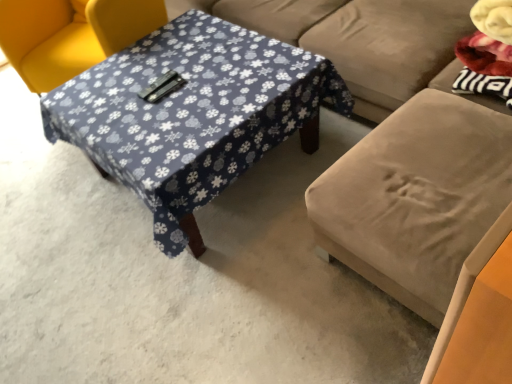
Question: Is yellow fabric chair at upper left taller or shorter than blue fabric-covered table at center?

Choices:
 (A) short
 (B) tall

Answer: (B)

Question: Is yellow fabric chair at upper left wider or thinner than blue fabric-covered table at center?

Choices:
 (A) wide
 (B) thin

Answer: (B)

Question: Which is farther from the velvet beige studio couch at center?

Choices:
 (A) blue fabric-covered table at center
 (B) yellow fabric chair at upper left

Answer: (B)

Question: Which of these objects is positioned closest to the blue fabric-covered table at center?

Choices:
 (A) yellow fabric chair at upper left
 (B) velvet beige studio couch at center

Answer: (B)